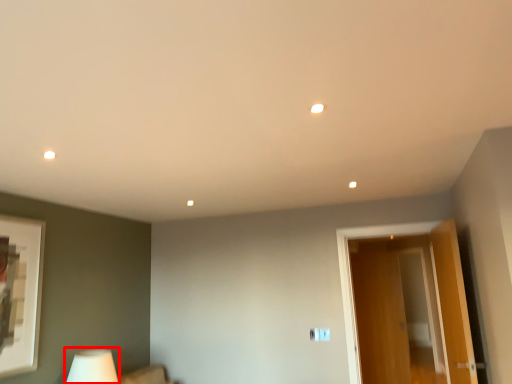
Question: In this image, where is table lamp (annotated by the red box) located relative to door?

Choices:
 (A) right
 (B) left

Answer: (B)